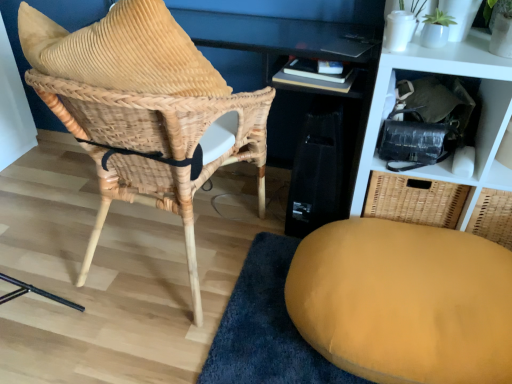
Where is `free space to the left of woven rattan chair at left`? The image size is (512, 384). free space to the left of woven rattan chair at left is located at coordinates (56, 208).